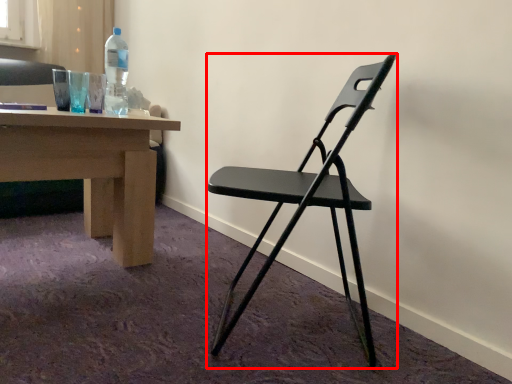
Question: From the image's perspective, considering the relative positions of chair (annotated by the red box) and bottle in the image provided, where is chair (annotated by the red box) located with respect to the staircase?

Choices:
 (A) above
 (B) below

Answer: (B)